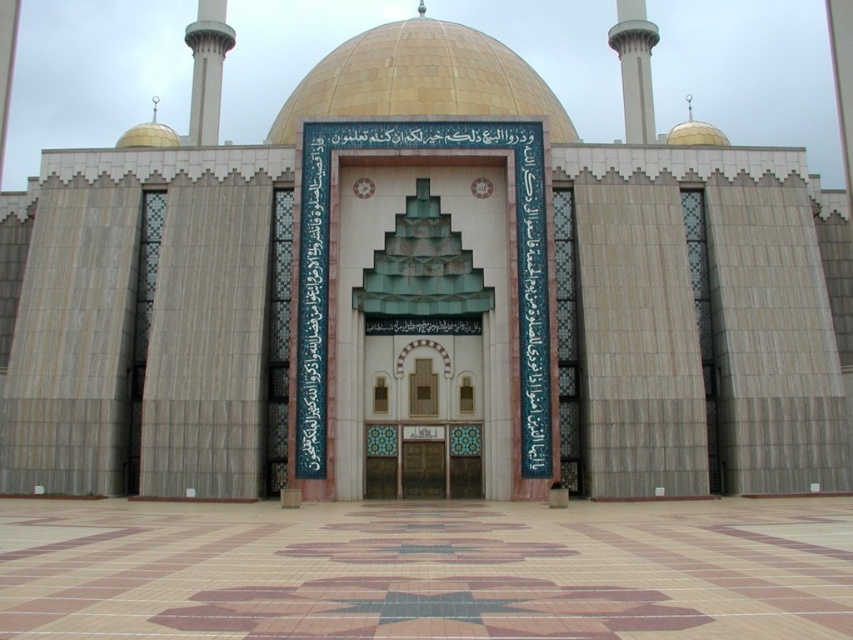
Question: Does gold mosaic dome at center appear under white concrete minaret at upper center?

Choices:
 (A) no
 (B) yes

Answer: (B)

Question: Can you confirm if gold mosaic dome at center is bigger than white marble minaret at upper left?

Choices:
 (A) yes
 (B) no

Answer: (A)

Question: Considering the real-world distances, which object is closest to the white concrete minaret at upper center?

Choices:
 (A) white marble minaret at upper left
 (B) gold mosaic dome at center

Answer: (B)

Question: Does gold mosaic dome at center appear under white marble minaret at upper left?

Choices:
 (A) yes
 (B) no

Answer: (A)

Question: Which of the following is the farthest from the observer?

Choices:
 (A) (469, 45)
 (B) (636, 1)

Answer: (B)

Question: Estimate the real-world distances between objects in this image. Which object is farther from the gold mosaic dome at center?

Choices:
 (A) white marble minaret at upper left
 (B) white concrete minaret at upper center

Answer: (A)